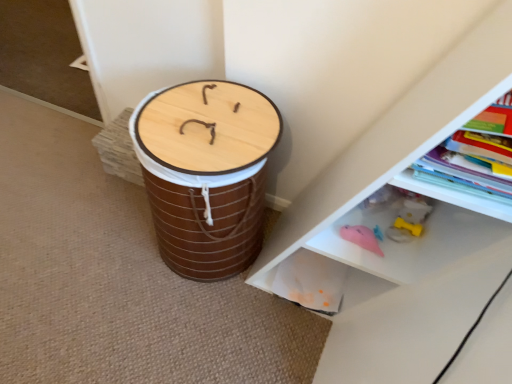
What is the approximate width of white plastic shelf at lower right?

white plastic shelf at lower right is 23.96 inches wide.

Describe the element at coordinates (208, 185) in the screenshot. This screenshot has height=384, width=512. I see `wooden drum at center` at that location.

Describe the element at coordinates (464, 173) in the screenshot. I see `hardcover book at upper right` at that location.

The height and width of the screenshot is (384, 512). I want to click on white plastic shelf at lower right, so click(415, 239).

Identify the location of book located on the right of white plastic shelf at lower right. (464, 173).

Relative to white plastic shelf at lower right, is hardcover book at upper right in front or behind?

hardcover book at upper right is positioned farther from the viewer than white plastic shelf at lower right.

Is hardcover book at upper right positioned far away from white plastic shelf at lower right?

hardcover book at upper right is actually quite close to white plastic shelf at lower right.

From the image's perspective, would you say hardcover book at upper right is positioned over wooden drum at center?

Correct, hardcover book at upper right appears higher than wooden drum at center in the image.

Where is `drum that is under the hardcover book at upper right (from a real-world perspective)`? The width and height of the screenshot is (512, 384). drum that is under the hardcover book at upper right (from a real-world perspective) is located at coordinates (208, 185).

Based on their sizes in the image, would you say hardcover book at upper right is bigger or smaller than wooden drum at center?

hardcover book at upper right is smaller than wooden drum at center.

Is hardcover book at upper right to the left or to the right of wooden drum at center in the image?

hardcover book at upper right is positioned on wooden drum at center's right side.

Would you say white plastic shelf at lower right is outside wooden drum at center?

white plastic shelf at lower right is positioned outside wooden drum at center.

The width and height of the screenshot is (512, 384). In the image, there is a white plastic shelf at lower right. Identify the location of drum below it (from a real-world perspective). (208, 185).

Is white plastic shelf at lower right touching wooden drum at center?

No, white plastic shelf at lower right is not beside wooden drum at center.

Is white plastic shelf at lower right taller or shorter than wooden drum at center?

Clearly, white plastic shelf at lower right is taller compared to wooden drum at center.

At what (x,y) coordinates should I click in order to perform the action: click on drum located on the left of hardcover book at upper right. Please return your answer as a coordinate pair (x, y). This screenshot has width=512, height=384. Looking at the image, I should click on (208, 185).

How many degrees apart are the facing directions of wooden drum at center and hardcover book at upper right?

The facing directions of wooden drum at center and hardcover book at upper right are 4.71 degrees apart.

Is wooden drum at center taller than hardcover book at upper right?

Indeed, wooden drum at center has a greater height compared to hardcover book at upper right.

Is wooden drum at center inside or outside of hardcover book at upper right?

wooden drum at center is spatially situated outside hardcover book at upper right.

Considering the relative sizes of white plastic shelf at lower right and hardcover book at upper right in the image provided, is white plastic shelf at lower right thinner than hardcover book at upper right?

Incorrect, the width of white plastic shelf at lower right is not less than that of hardcover book at upper right.

Between white plastic shelf at lower right and hardcover book at upper right, which one has larger size?

white plastic shelf at lower right is bigger.

Which is in front, white plastic shelf at lower right or hardcover book at upper right?

white plastic shelf at lower right is in front.

What's the angular difference between wooden drum at center and white plastic shelf at lower right's facing directions?

The facing directions of wooden drum at center and white plastic shelf at lower right are 0.000698 degrees apart.

Is wooden drum at center touching white plastic shelf at lower right?

No.

In terms of size, does wooden drum at center appear bigger or smaller than white plastic shelf at lower right?

In the image, wooden drum at center appears to be smaller than white plastic shelf at lower right.

Would you say wooden drum at center is outside white plastic shelf at lower right?

That's correct, wooden drum at center is outside of white plastic shelf at lower right.

The image size is (512, 384). In order to click on shelf on the left of hardcover book at upper right in this screenshot , I will do `click(415, 239)`.

Where is `book above the wooden drum at center (from the image's perspective)`? book above the wooden drum at center (from the image's perspective) is located at coordinates (464, 173).

When comparing their distances from wooden drum at center, does hardcover book at upper right or white plastic shelf at lower right seem closer?

The object closer to wooden drum at center is white plastic shelf at lower right.

From the image, which object appears to be nearer to wooden drum at center, white plastic shelf at lower right or hardcover book at upper right?

white plastic shelf at lower right is positioned closer to the anchor wooden drum at center.

When comparing their distances from hardcover book at upper right, does wooden drum at center or white plastic shelf at lower right seem further?

wooden drum at center is further to hardcover book at upper right.

Considering their positions, is white plastic shelf at lower right positioned closer to hardcover book at upper right than wooden drum at center?

white plastic shelf at lower right is closer to hardcover book at upper right.

Considering their positions, is hardcover book at upper right positioned closer to white plastic shelf at lower right than wooden drum at center?

hardcover book at upper right.

From the image, which object appears to be farther from white plastic shelf at lower right, wooden drum at center or hardcover book at upper right?

→ wooden drum at center.

This screenshot has height=384, width=512. I want to click on book between white plastic shelf at lower right and wooden drum at center in the front-back direction, so pos(464,173).